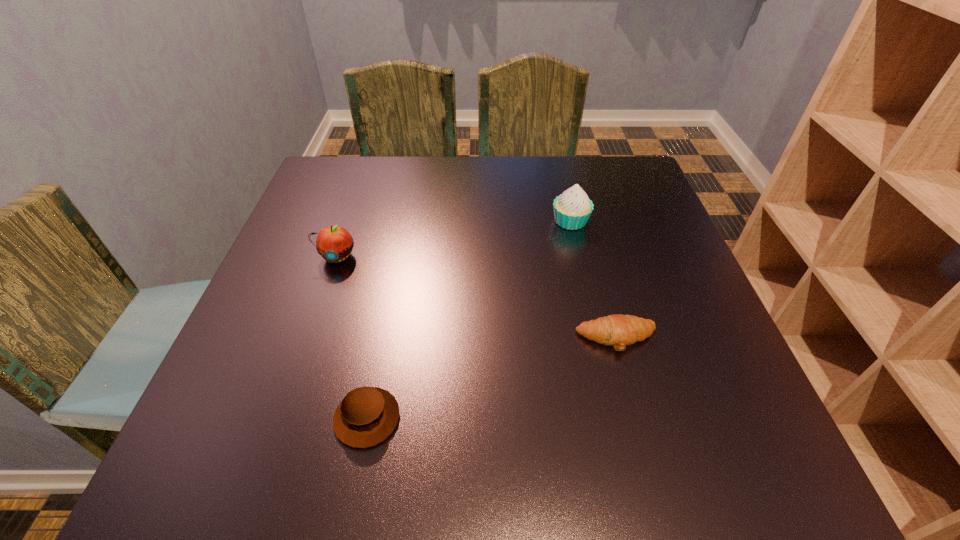
I want to click on vacant space located on the back of the muffin, so click(388, 313).

You are a GUI agent. You are given a task and a screenshot of the screen. Output one action in this format:
    pyautogui.click(x=<x>, y=<y>)
    Task: Click on the vacant space situated 0.200m on the back of the shortest object
    This screenshot has height=540, width=960.
    Given the screenshot: What is the action you would take?
    pyautogui.click(x=594, y=254)

Locate an element on the screen. object present at the near edge is located at coordinates click(366, 416).

At what (x,y) coordinates should I click in order to perform the action: click on object that is at the left edge. Please return your answer as a coordinate pair (x, y). The image size is (960, 540). Looking at the image, I should click on (334, 243).

Locate an element on the screen. object located at the right edge is located at coordinates (619, 330).

Where is `free region at the far edge of the desktop`? The width and height of the screenshot is (960, 540). free region at the far edge of the desktop is located at coordinates (502, 180).

Where is `free space at the near edge`? This screenshot has width=960, height=540. free space at the near edge is located at coordinates (598, 483).

Where is `free location at the left edge`? free location at the left edge is located at coordinates tap(247, 392).

In the image, there is a desktop. Where is `vacant area at the right edge`? The width and height of the screenshot is (960, 540). vacant area at the right edge is located at coordinates (657, 253).

Identify the location of free space at the far left corner of the desktop. This screenshot has width=960, height=540. (363, 156).